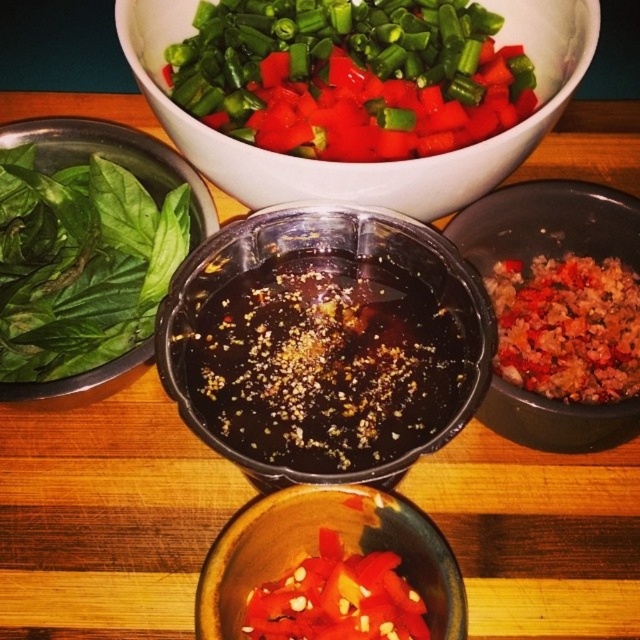
Question: Estimate the real-world distances between objects in this image. Which object is farther from the green leafy material/texture at left?

Choices:
 (A) black plastic bowl at center
 (B) brown crumbly mixture at right
 (C) brown crumbly rice at right
 (D) white ceramic bowl at upper center

Answer: (C)

Question: Observing the image, what is the correct spatial positioning of white ceramic bowl at upper center in reference to brown crumbly mixture at right?

Choices:
 (A) below
 (B) above

Answer: (B)

Question: Considering the real-world distances, which object is closest to the white ceramic bowl at upper center?

Choices:
 (A) matte ceramic bowl at lower center
 (B) black plastic bowl at center

Answer: (B)

Question: Which object appears closest to the camera in this image?

Choices:
 (A) brown crumbly rice at right
 (B) green leafy material/texture at left
 (C) white ceramic bowl at upper center

Answer: (C)

Question: Observing the image, what is the correct spatial positioning of white ceramic bowl at upper center in reference to matte ceramic bowl at lower center?

Choices:
 (A) left
 (B) right

Answer: (B)

Question: Can you confirm if black plastic bowl at center is positioned below green leafy material/texture at left?

Choices:
 (A) no
 (B) yes

Answer: (B)